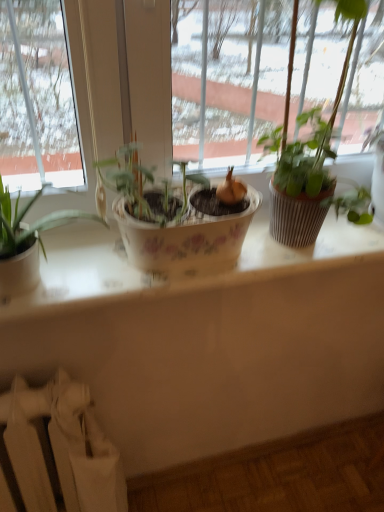
Describe the element at coordinates (307, 156) in the screenshot. The image size is (384, 512). I see `green matte plant at upper right` at that location.

Identify the location of green matte plant at upper right. (307, 156).

Describe the element at coordinates (61, 448) in the screenshot. I see `white fabric radiator at lower left` at that location.

In order to click on white fabric radiator at lower left in this screenshot , I will do `click(61, 448)`.

Where is `green matte plant at upper right`? green matte plant at upper right is located at coordinates (307, 156).

Which is more to the right, white fabric radiator at lower left or green matte plant at upper right?

green matte plant at upper right.

Does white fabric radiator at lower left lie in front of green matte plant at upper right?

No, white fabric radiator at lower left is further to the viewer.

Which is further, [81,454] or [304,169]?

Positioned behind is point [81,454].

From the image's perspective, which one is positioned lower, white fabric radiator at lower left or green matte plant at upper right?

white fabric radiator at lower left appears lower in the image.

From a real-world perspective, is white fabric radiator at lower left physically located above or below green matte plant at upper right?

white fabric radiator at lower left is situated lower than green matte plant at upper right in the real world.

Is white fabric radiator at lower left thinner than green matte plant at upper right?

Incorrect, the width of white fabric radiator at lower left is not less than that of green matte plant at upper right.

Which of these two, white fabric radiator at lower left or green matte plant at upper right, stands taller?

Standing taller between the two is white fabric radiator at lower left.

Considering the sizes of objects white fabric radiator at lower left and green matte plant at upper right in the image provided, who is bigger, white fabric radiator at lower left or green matte plant at upper right?

white fabric radiator at lower left.

Would you say white fabric radiator at lower left is inside or outside green matte plant at upper right?

white fabric radiator at lower left lies outside green matte plant at upper right.

Is white fabric radiator at lower left next to green matte plant at upper right and touching it?

No, white fabric radiator at lower left is not making contact with green matte plant at upper right.

Is white fabric radiator at lower left turned away from green matte plant at upper right?

No.

How far apart are white fabric radiator at lower left and green matte plant at upper right?

white fabric radiator at lower left is 30.46 inches from green matte plant at upper right.

Find the location of a particular element. radiator below the green matte plant at upper right (from a real-world perspective) is located at coordinates (61, 448).

Is green matte plant at upper right to the right of white fabric radiator at lower left from the viewer's perspective?

Yes, green matte plant at upper right is to the right of white fabric radiator at lower left.

Based on the photo, between green matte plant at upper right and white fabric radiator at lower left, which one is positioned in front?

Positioned in front is green matte plant at upper right.

Which is in front, point (352, 213) or point (14, 441)?

The point (352, 213) is closer.

From the image's perspective, which is below, green matte plant at upper right or white fabric radiator at lower left?

From the image's view, white fabric radiator at lower left is below.

From a real-world perspective, is green matte plant at upper right positioned under white fabric radiator at lower left based on gravity?

No, from a real-world perspective, green matte plant at upper right is not beneath white fabric radiator at lower left.

Which of these two, green matte plant at upper right or white fabric radiator at lower left, is thinner?

green matte plant at upper right.

Who is taller, green matte plant at upper right or white fabric radiator at lower left?

With more height is white fabric radiator at lower left.

Is green matte plant at upper right bigger or smaller than white fabric radiator at lower left?

green matte plant at upper right is smaller than white fabric radiator at lower left.

Is green matte plant at upper right spatially inside white fabric radiator at lower left, or outside of it?

green matte plant at upper right lies outside white fabric radiator at lower left.

Is green matte plant at upper right far from white fabric radiator at lower left?

They are positioned close to each other.

Could you tell me if green matte plant at upper right is turned towards white fabric radiator at lower left?

No, green matte plant at upper right is not oriented towards white fabric radiator at lower left.

In the scene shown: What's the angular difference between green matte plant at upper right and white fabric radiator at lower left's facing directions?

2.78 degrees separate the facing orientations of green matte plant at upper right and white fabric radiator at lower left.

How far apart are green matte plant at upper right and white fabric radiator at lower left?

They are 30.46 inches apart.

This screenshot has width=384, height=512. In order to click on houseplant that is on the right side of white fabric radiator at lower left in this screenshot , I will do `click(307, 156)`.

Where is `radiator located on the left of green matte plant at upper right`? radiator located on the left of green matte plant at upper right is located at coordinates (61, 448).

The image size is (384, 512). I want to click on radiator located below the green matte plant at upper right (from the image's perspective), so click(x=61, y=448).